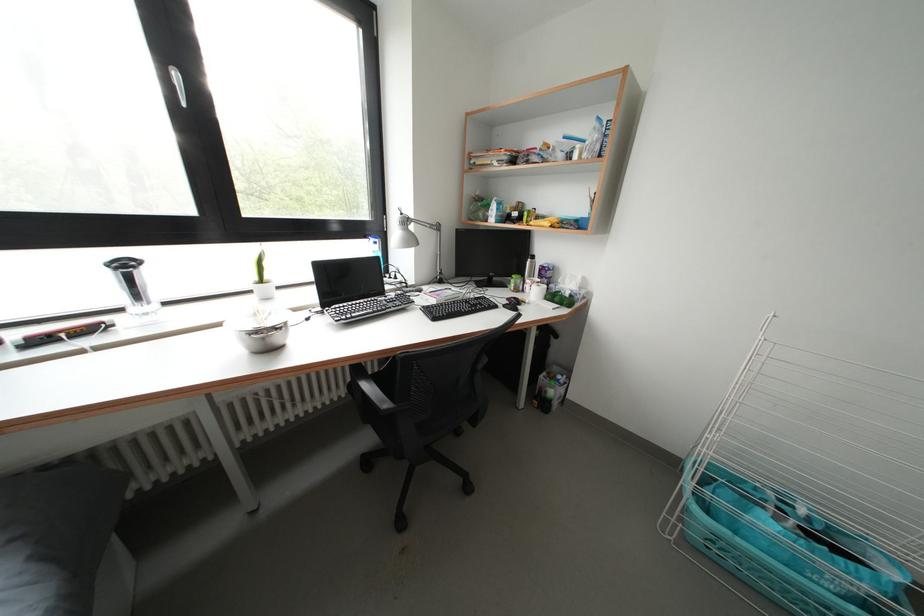
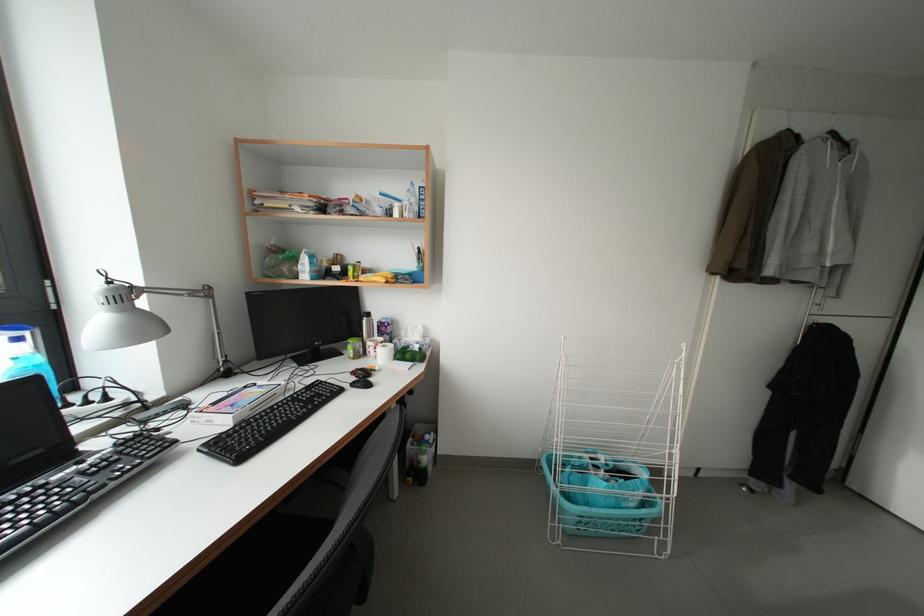
Question: The first image is from the beginning of the video and the second image is from the end. How did the camera likely rotate when shooting the video?

Choices:
 (A) Left
 (B) Right
 (C) Up
 (D) Down

Answer: (B)